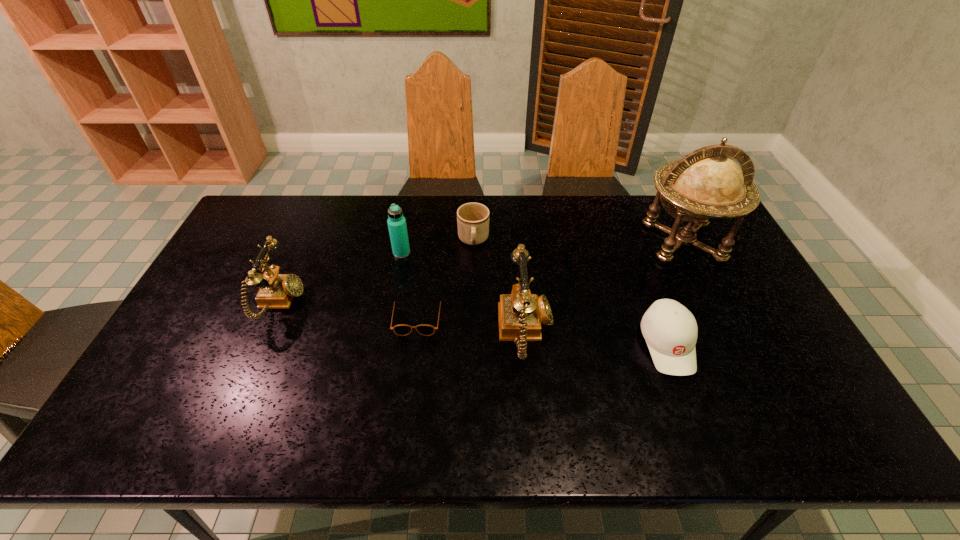
Where is `free space between the mug and the tallest object`? free space between the mug and the tallest object is located at coordinates (578, 241).

Image resolution: width=960 pixels, height=540 pixels. I want to click on free space between the fourth object from left to right and the water bottle, so click(x=438, y=247).

I want to click on empty space that is in between the water bottle and the left telephone, so click(x=341, y=278).

Locate an element on the screen. This screenshot has height=540, width=960. blank region between the right telephone and the mug is located at coordinates (500, 286).

I want to click on empty location between the shortest object and the fourth object from right to left, so click(x=445, y=279).

This screenshot has width=960, height=540. What are the coordinates of `blank region between the taller telephone and the tallest object` in the screenshot? It's located at (605, 287).

Image resolution: width=960 pixels, height=540 pixels. What are the coordinates of `vacant space in between the fourth object from right to left and the globe` in the screenshot? It's located at (578, 241).

Find the location of `the sixth closest object to the baseball cap`. the sixth closest object to the baseball cap is located at coordinates (276, 291).

Locate an element on the screen. This screenshot has width=960, height=540. object that stands as the fourth closest to the fifth object from left to right is located at coordinates (396, 221).

The height and width of the screenshot is (540, 960). Identify the location of vacant space that satisfies the following two spatial constraints: 1. on the side of the fourth object from right to left with the handle; 2. on the dial number of the shorter telephone. [472, 302].